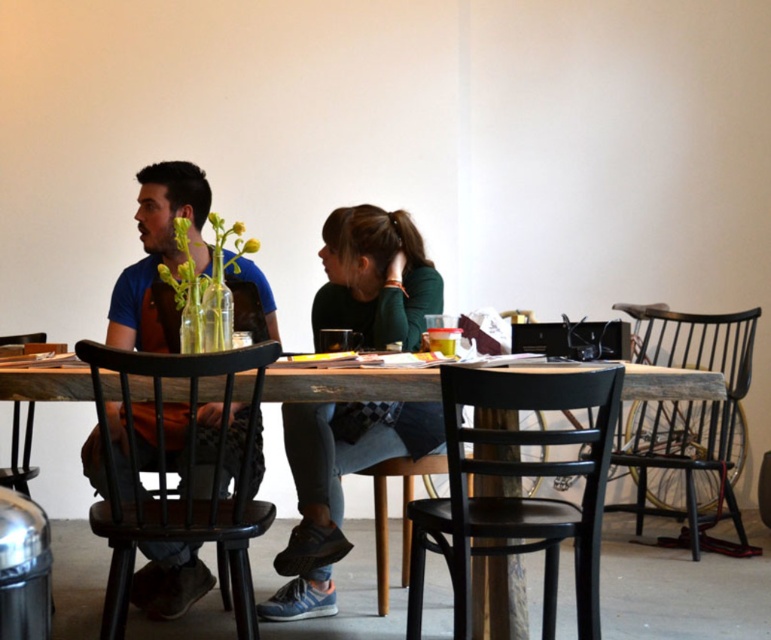
Who is positioned more to the right, matte blue shirt at left or dark brown wooden chair at lower left?

Positioned to the right is dark brown wooden chair at lower left.

Is point (153, 275) closer to camera compared to point (143, 500)?

No, it is behind (143, 500).

Measure the distance between matte blue shirt at left and camera.

matte blue shirt at left and camera are 2.11 meters apart from each other.

This screenshot has height=640, width=771. In order to click on matte blue shirt at left in this screenshot , I will do `click(160, 257)`.

Can you confirm if reclaimed wood table at center is positioned to the left of dark brown wooden chair at lower left?

No, reclaimed wood table at center is not to the left of dark brown wooden chair at lower left.

Is point (322, 392) more distant than point (110, 580)?

No.

Image resolution: width=771 pixels, height=640 pixels. I want to click on reclaimed wood table at center, so click(x=349, y=384).

Who is higher up, matte blue shirt at left or reclaimed wood table at center?

reclaimed wood table at center is higher up.

Does matte blue shirt at left appear over reclaimed wood table at center?

No, matte blue shirt at left is not above reclaimed wood table at center.

Identify the location of matte blue shirt at left. (160, 257).